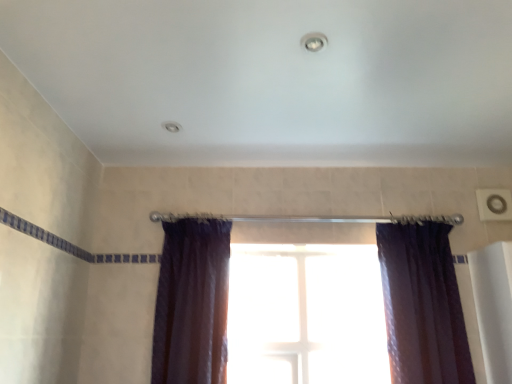
Question: From the image's perspective, is satin purple curtain at right, the 1th curtain from the right, located above transparent glass window at center?

Choices:
 (A) yes
 (B) no

Answer: (A)

Question: From a real-world perspective, is satin purple curtain at right, which is the second curtain in left-to-right order, positioned over transparent glass window at center based on gravity?

Choices:
 (A) no
 (B) yes

Answer: (B)

Question: Is satin purple curtain at right, the 1th curtain from the right, shorter than transparent glass window at center?

Choices:
 (A) yes
 (B) no

Answer: (B)

Question: From the image's perspective, is satin purple curtain at right, which is the second curtain in left-to-right order, under transparent glass window at center?

Choices:
 (A) yes
 (B) no

Answer: (B)

Question: Is satin purple curtain at right, which is the second curtain in left-to-right order, taller than transparent glass window at center?

Choices:
 (A) yes
 (B) no

Answer: (A)

Question: Visually, is transparent glass window at center positioned to the left or to the right of satin dark purple curtain at center, placed as the 1th curtain when sorted from left to right?

Choices:
 (A) left
 (B) right

Answer: (B)

Question: Looking at their shapes, would you say transparent glass window at center is wider or thinner than satin dark purple curtain at center, placed as the 1th curtain when sorted from left to right?

Choices:
 (A) wide
 (B) thin

Answer: (B)

Question: Looking at the image, does transparent glass window at center seem bigger or smaller compared to satin dark purple curtain at center, placed as the 1th curtain when sorted from left to right?

Choices:
 (A) big
 (B) small

Answer: (B)

Question: Considering the positions of point (331, 345) and point (169, 306), is point (331, 345) closer or farther from the camera than point (169, 306)?

Choices:
 (A) farther
 (B) closer

Answer: (A)

Question: Which is correct: satin dark purple curtain at center, positioned as the 2th curtain in right-to-left order, is inside satin purple curtain at right, the 1th curtain from the right, or outside of it?

Choices:
 (A) outside
 (B) inside

Answer: (A)

Question: Considering the positions of point (163, 307) and point (453, 365), is point (163, 307) closer or farther from the camera than point (453, 365)?

Choices:
 (A) farther
 (B) closer

Answer: (A)

Question: From the image's perspective, is satin dark purple curtain at center, positioned as the 2th curtain in right-to-left order, positioned above or below satin purple curtain at right, the 1th curtain from the right?

Choices:
 (A) below
 (B) above

Answer: (B)

Question: Considering the positions of satin dark purple curtain at center, positioned as the 2th curtain in right-to-left order, and satin purple curtain at right, which is the second curtain in left-to-right order, in the image, is satin dark purple curtain at center, positioned as the 2th curtain in right-to-left order, wider or thinner than satin purple curtain at right, which is the second curtain in left-to-right order,?

Choices:
 (A) thin
 (B) wide

Answer: (B)

Question: From the image's perspective, is satin purple curtain at right, the 1th curtain from the right, above or below satin dark purple curtain at center, placed as the 1th curtain when sorted from left to right?

Choices:
 (A) below
 (B) above

Answer: (A)

Question: Considering the positions of satin purple curtain at right, which is the second curtain in left-to-right order, and satin dark purple curtain at center, positioned as the 2th curtain in right-to-left order, in the image, is satin purple curtain at right, which is the second curtain in left-to-right order, taller or shorter than satin dark purple curtain at center, positioned as the 2th curtain in right-to-left order,?

Choices:
 (A) short
 (B) tall

Answer: (A)